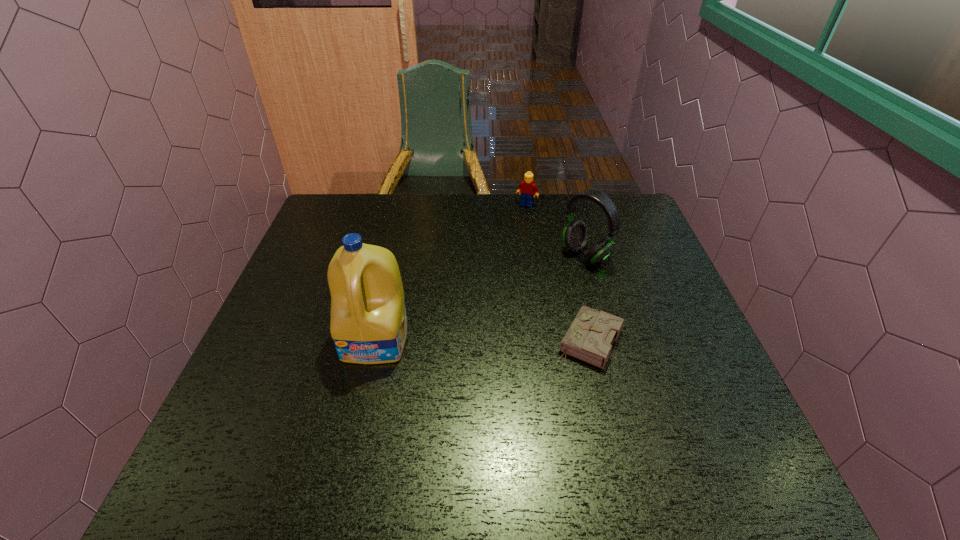
At what (x,y) coordinates should I click in order to perform the action: click on free space located 0.400m on the front-facing side of the Lego. Please return your answer as a coordinate pair (x, y). Looking at the image, I should click on (484, 286).

The width and height of the screenshot is (960, 540). I want to click on vacant space located 0.370m on the front-facing side of the Lego, so click(487, 279).

I want to click on free point located on the ear cups of the third shortest object, so click(x=554, y=277).

Locate an element on the screen. free space located on the ear cups of the third shortest object is located at coordinates (480, 328).

You are a GUI agent. You are given a task and a screenshot of the screen. Output one action in this format:
    pyautogui.click(x=<x>, y=<y>)
    Task: Click on the vacant space situated 0.320m on the ear cups of the third shortest object
    
    Given the screenshot: What is the action you would take?
    pyautogui.click(x=486, y=323)

I want to click on object that is at the far edge, so click(527, 188).

At what (x,y) coordinates should I click in order to perform the action: click on object present at the right edge. Please return your answer as a coordinate pair (x, y). This screenshot has height=540, width=960. Looking at the image, I should click on (575, 237).

Image resolution: width=960 pixels, height=540 pixels. I want to click on free region at the far edge, so click(504, 217).

The height and width of the screenshot is (540, 960). In order to click on vacant space at the near edge in this screenshot , I will do `click(386, 415)`.

In the image, there is a desktop. At what (x,y) coordinates should I click in order to perform the action: click on vacant space at the left edge. Please return your answer as a coordinate pair (x, y). Looking at the image, I should click on (281, 341).